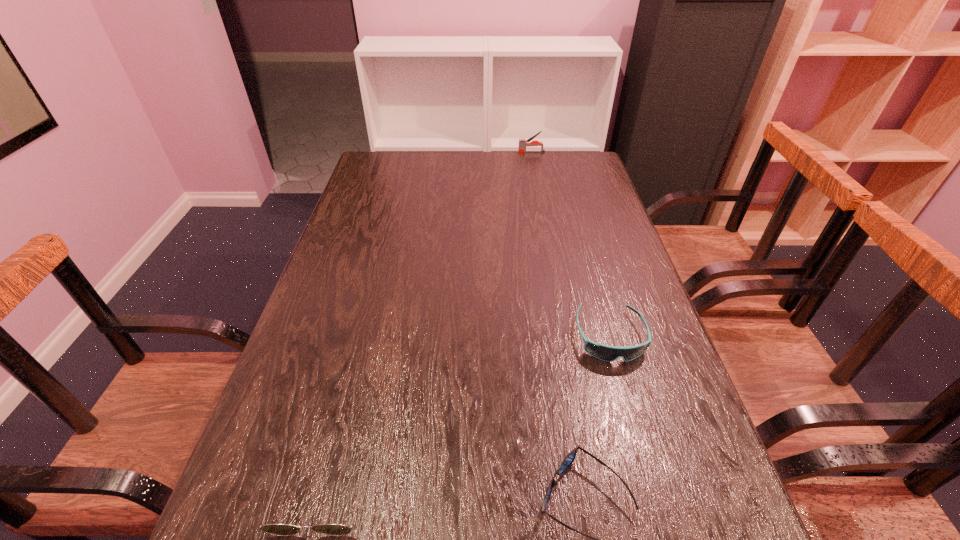
The height and width of the screenshot is (540, 960). I want to click on object located at the right edge, so [x=603, y=352].

Identify the location of free region at the far edge of the desktop. Image resolution: width=960 pixels, height=540 pixels. (451, 175).

Image resolution: width=960 pixels, height=540 pixels. In order to click on vacant point at the left edge in this screenshot , I will do `click(324, 310)`.

At what (x,y) coordinates should I click in order to perform the action: click on vacant region at the right edge of the desktop. Please return your answer as a coordinate pair (x, y). Image resolution: width=960 pixels, height=540 pixels. Looking at the image, I should click on (590, 237).

The height and width of the screenshot is (540, 960). In order to click on free region at the far left corner of the desktop in this screenshot , I will do `click(396, 183)`.

Where is `vacant space at the far right corner of the desktop`? The image size is (960, 540). vacant space at the far right corner of the desktop is located at coordinates (578, 175).

Find the location of a particular element. The width and height of the screenshot is (960, 540). free space between the farthest sunglasses and the leftmost sunglasses is located at coordinates (466, 414).

This screenshot has height=540, width=960. In order to click on empty space that is in between the farthest object and the leftmost sunglasses in this screenshot , I will do `click(427, 322)`.

Identify the location of empty location between the tallest object and the farthest sunglasses. (570, 244).

I want to click on empty location between the tallest object and the leftmost sunglasses, so click(427, 322).